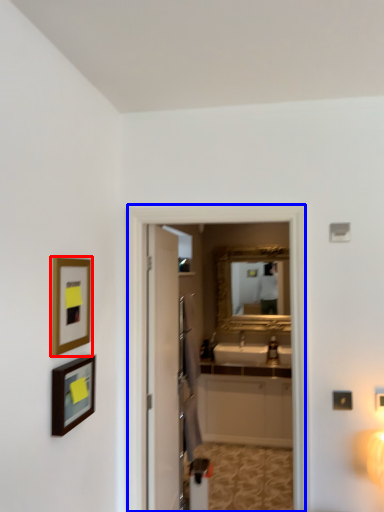
Question: Which of the following is the closest to the observer, picture frame (highlighted by a red box) or screen door (highlighted by a blue box)?

Choices:
 (A) picture frame
 (B) screen door

Answer: (A)